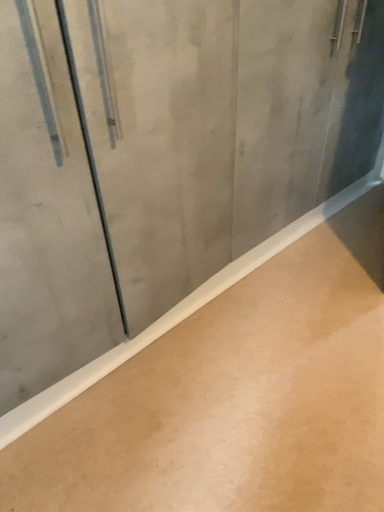
I want to click on free space above smooth concrete at center (from a real-world perspective), so 269,339.